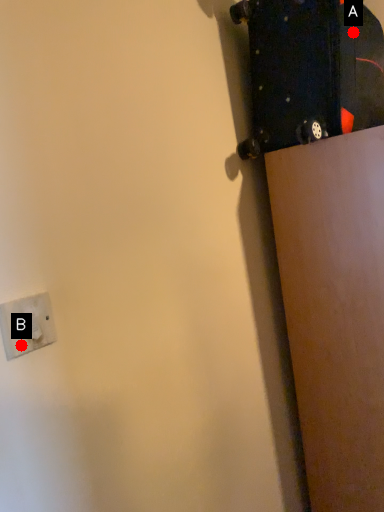
Question: Two points are circled on the image, labeled by A and B beside each circle. Which point is closer to the camera?

Choices:
 (A) A is closer
 (B) B is closer

Answer: (B)